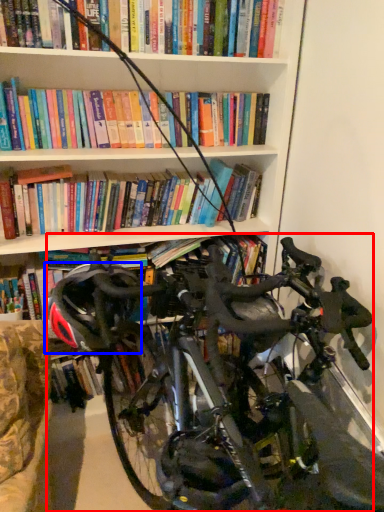
Question: Which of the following is the farthest to the observer, bicycle (highlighted by a red box) or helmet (highlighted by a blue box)?

Choices:
 (A) bicycle
 (B) helmet

Answer: (B)